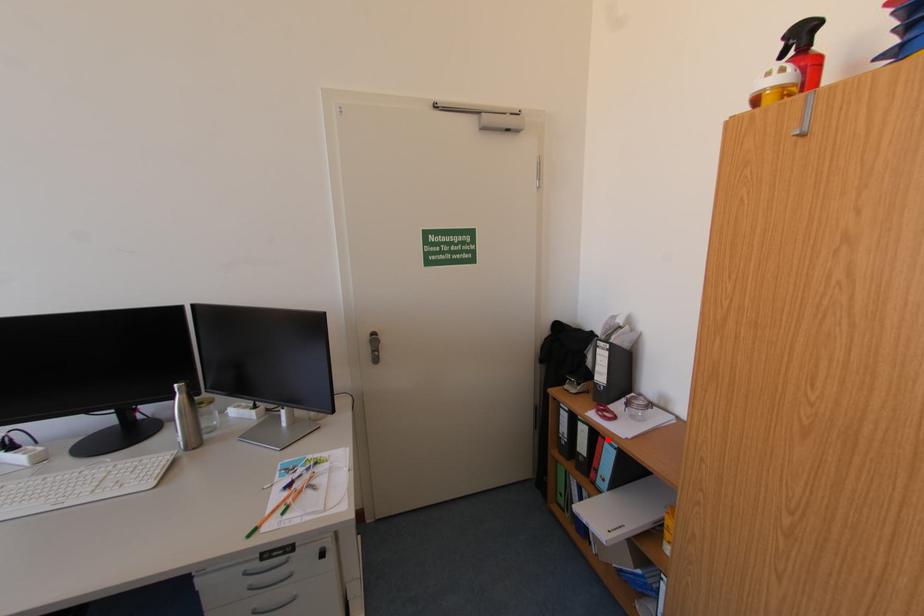
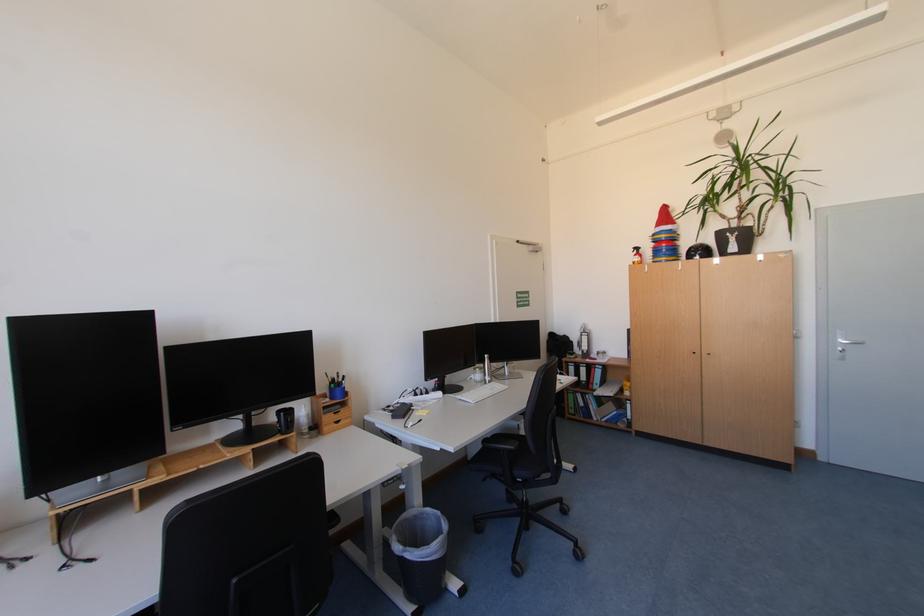
Where in the second image is the point corresponding to the highlighted location from the first image?

(601, 370)